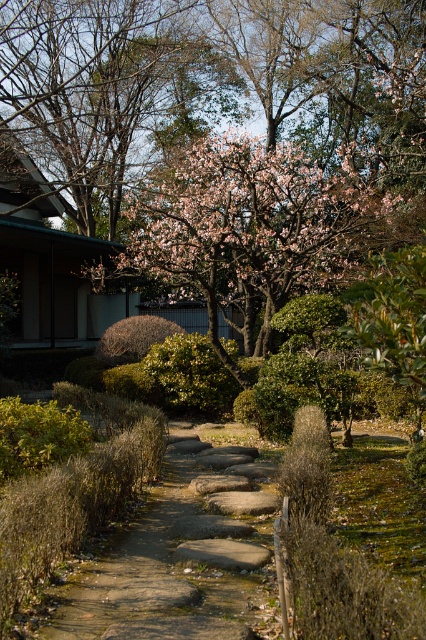
You are a gardener who needs to place a 3 meter wide decorative stone fountain between the pink blossom tree at upper center and the traditional Japanese building in the background. Is there enough space between them to place the fountain?

The distance between the pink blossom tree at upper center and the traditional Japanese building in the background is 9.13 meters. Since the fountain is 3 meters wide, there is sufficient space to place it between them as the distance is greater than the fountain width.

You are a gardener planning to plant a new bush along the natural stone pathway at center. According to the garden layout, where should you place the new bush relative to the pink blossom tree at upper center?

The pink blossom tree at upper center is to the right of the natural stone pathway at center, so you should place the new bush to the left of the pink blossom tree at upper center to maintain symmetry along the natural stone pathway at center.

You are standing at the entrance of the garden and want to take a photo of the pink blossom tree at upper center. Based on its position, which direction should you face to ensure it is centered in your camera view?

The pink blossom tree at upper center is located at point coordinates of 0.211 on the x axis and 0.535 on the y axis. To center it in your camera view, you should face towards the upper center direction, which corresponds to the coordinates given.